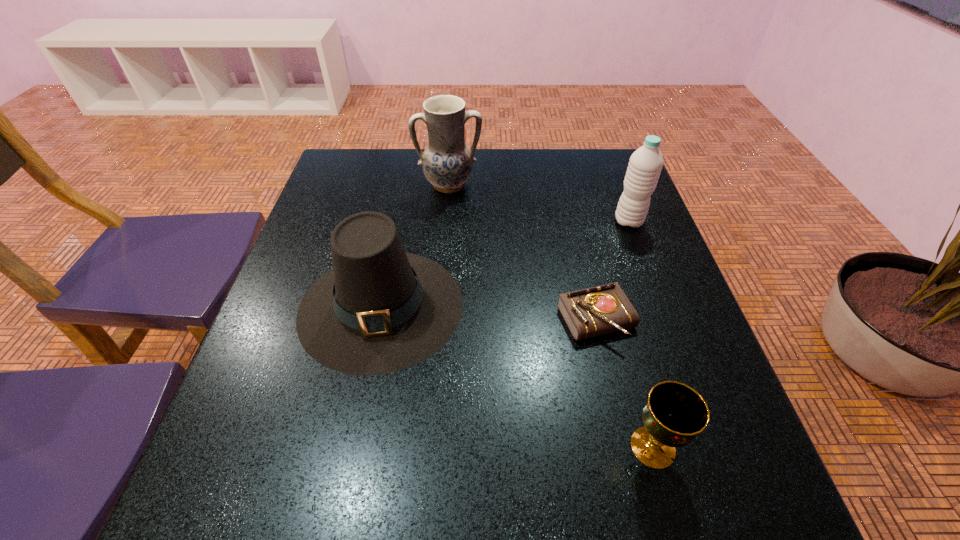
The height and width of the screenshot is (540, 960). I want to click on free point between the nearest object and the farthest object, so click(551, 316).

Find the location of a particular element. This screenshot has height=540, width=960. free spot between the third shortest object and the rightmost object is located at coordinates (505, 264).

Locate an element on the screen. vacant space in between the water bottle and the shortest object is located at coordinates (x=612, y=270).

Identify the location of vacant area that lies between the second shortest object and the third shortest object. This screenshot has width=960, height=540. (517, 376).

The width and height of the screenshot is (960, 540). In order to click on free space between the rightmost object and the third shortest object in this screenshot , I will do pos(505,264).

This screenshot has height=540, width=960. I want to click on free spot between the diary and the chalice, so click(x=625, y=383).

Locate which object ranks fourth in proximity to the rightmost object. Please provide its 2D coordinates. Your answer should be formatted as a tuple, i.e. [(x, y)], where the tuple contains the x and y coordinates of a point satisfying the conditions above.

[(674, 414)]

In order to click on the closest object to the diary in this screenshot , I will do `click(674, 414)`.

I want to click on vacant space that satisfies the following two spatial constraints: 1. on the front-facing side of the shortest object; 2. on the left side of the third shortest object, so click(378, 319).

The image size is (960, 540). Identify the location of vacant space that satisfies the following two spatial constraints: 1. on the front-facing side of the diary; 2. on the left side of the hat. (378, 319).